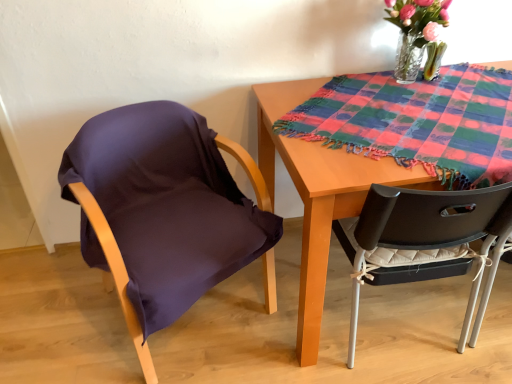
Question: Is multicolored woven cloth at upper right located outside purple fabric chair at left?

Choices:
 (A) no
 (B) yes

Answer: (B)

Question: From a real-world perspective, is multicolored woven cloth at upper right positioned over purple fabric chair at left based on gravity?

Choices:
 (A) yes
 (B) no

Answer: (A)

Question: Considering the relative positions of multicolored woven cloth at upper right and purple fabric chair at left in the image provided, is multicolored woven cloth at upper right to the right of purple fabric chair at left from the viewer's perspective?

Choices:
 (A) no
 (B) yes

Answer: (B)

Question: Are multicolored woven cloth at upper right and purple fabric chair at left located far from each other?

Choices:
 (A) no
 (B) yes

Answer: (A)

Question: Is multicolored woven cloth at upper right closer to camera compared to purple fabric chair at left?

Choices:
 (A) yes
 (B) no

Answer: (B)

Question: Considering the relative positions of translucent glass vase at upper right and wooden table at center in the image provided, is translucent glass vase at upper right to the left or to the right of wooden table at center?

Choices:
 (A) right
 (B) left

Answer: (A)

Question: From a real-world perspective, relative to wooden table at center, is translucent glass vase at upper right vertically above or below?

Choices:
 (A) above
 (B) below

Answer: (A)

Question: Which is correct: translucent glass vase at upper right is inside wooden table at center, or outside of it?

Choices:
 (A) outside
 (B) inside

Answer: (A)

Question: Considering the positions of translucent glass vase at upper right and wooden table at center in the image, is translucent glass vase at upper right wider or thinner than wooden table at center?

Choices:
 (A) wide
 (B) thin

Answer: (B)

Question: Considering the positions of translucent glass vase at upper right and purple fabric chair at left in the image, is translucent glass vase at upper right bigger or smaller than purple fabric chair at left?

Choices:
 (A) small
 (B) big

Answer: (A)

Question: From a real-world perspective, is translucent glass vase at upper right physically located above or below purple fabric chair at left?

Choices:
 (A) above
 (B) below

Answer: (A)

Question: From the image's perspective, relative to purple fabric chair at left, is translucent glass vase at upper right above or below?

Choices:
 (A) below
 (B) above

Answer: (B)

Question: Relative to purple fabric chair at left, is translucent glass vase at upper right in front or behind?

Choices:
 (A) front
 (B) behind

Answer: (B)

Question: Is wooden table at center wider or thinner than purple fabric chair at left?

Choices:
 (A) thin
 (B) wide

Answer: (A)

Question: Is wooden table at center inside or outside of purple fabric chair at left?

Choices:
 (A) inside
 (B) outside

Answer: (B)